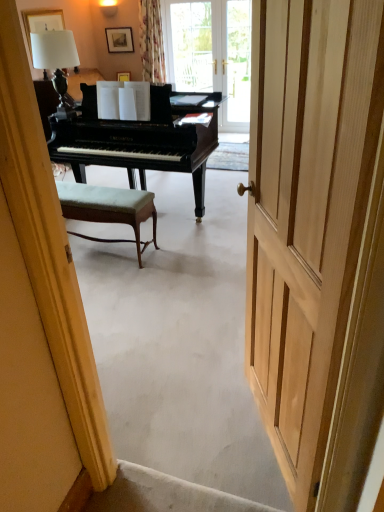
The height and width of the screenshot is (512, 384). Describe the element at coordinates (307, 212) in the screenshot. I see `light wood door at center` at that location.

This screenshot has height=512, width=384. Describe the element at coordinates (238, 63) in the screenshot. I see `clear glass door at center` at that location.

Find the location of a particular element. floral fabric curtain at upper center is located at coordinates (151, 41).

What do you see at coordinates (124, 76) in the screenshot?
I see `matte gold picture frame at upper center, which is the first picture frame from bottom to top` at bounding box center [124, 76].

The width and height of the screenshot is (384, 512). In order to click on green fabric bench at center in this screenshot , I will do `click(108, 209)`.

The height and width of the screenshot is (512, 384). What do you see at coordinates (141, 139) in the screenshot?
I see `high-gloss black piano at center` at bounding box center [141, 139].

What do you see at coordinates (119, 40) in the screenshot? I see `matte black picture frame at upper center, which ranks as the 2th picture frame in bottom-to-top order` at bounding box center [119, 40].

This screenshot has height=512, width=384. Identify the location of light wood door at center. (307, 212).

Can we say clear glass door at center lies outside high-gloss black piano at center?

That's correct, clear glass door at center is outside of high-gloss black piano at center.

Which object is positioned more to the right, clear glass door at center or high-gloss black piano at center?

clear glass door at center is more to the right.

Is clear glass door at center thinner than high-gloss black piano at center?

Indeed, clear glass door at center has a lesser width compared to high-gloss black piano at center.

How distant is clear glass door at center from high-gloss black piano at center?

A distance of 7.12 feet exists between clear glass door at center and high-gloss black piano at center.

Is the position of matte black picture frame at upper center, which ranks as the 2th picture frame in bottom-to-top order, more distant than that of white fabric lampshade at upper left?

Yes, matte black picture frame at upper center, which ranks as the 2th picture frame in bottom-to-top order, is further from the camera.

Is matte black picture frame at upper center, the first picture frame viewed from the top, not near white fabric lampshade at upper left?

Indeed, matte black picture frame at upper center, the first picture frame viewed from the top, is not near white fabric lampshade at upper left.

Which object is thinner, matte black picture frame at upper center, the first picture frame viewed from the top, or white fabric lampshade at upper left?

matte black picture frame at upper center, the first picture frame viewed from the top, is thinner.

Who is taller, matte black picture frame at upper center, the first picture frame viewed from the top, or white fabric lampshade at upper left?

Standing taller between the two is white fabric lampshade at upper left.

Is green fabric bench at center positioned far away from light wood door at center?

Yes, green fabric bench at center is far from light wood door at center.

From a real-world perspective, between green fabric bench at center and light wood door at center, who is vertically lower?

green fabric bench at center.

Identify the location of door below the green fabric bench at center (from the image's perspective). (307, 212).

Which is correct: green fabric bench at center is inside high-gloss black piano at center, or outside of it?

green fabric bench at center is spatially situated outside high-gloss black piano at center.

Is green fabric bench at center wider than high-gloss black piano at center?

No.

This screenshot has height=512, width=384. I want to click on chair below the high-gloss black piano at center (from the image's perspective), so click(108, 209).

Is the position of green fabric bench at center less distant than that of high-gloss black piano at center?

No, green fabric bench at center is further to the viewer.

From a real-world perspective, who is located higher, clear glass door at center or matte black picture frame at upper center, the first picture frame viewed from the top?

matte black picture frame at upper center, the first picture frame viewed from the top.

Is clear glass door at center oriented towards matte black picture frame at upper center, which ranks as the 2th picture frame in bottom-to-top order?

No, clear glass door at center is not turned towards matte black picture frame at upper center, which ranks as the 2th picture frame in bottom-to-top order.

From the image's perspective, is light wood door at center beneath green fabric bench at center?

Yes, from the image's perspective, light wood door at center is below green fabric bench at center.

Does point (352, 276) come in front of point (64, 213)?

Yes, it is.

Is light wood door at center shorter than green fabric bench at center?

No.

Is white fabric lampshade at upper left bigger than matte gold picture frame at upper center, marked as the second picture frame in a top-to-bottom arrangement?

Yes.

Based on the photo, what's the angular difference between white fabric lampshade at upper left and matte gold picture frame at upper center, which is the first picture frame from bottom to top,'s facing directions?

5.63 degrees.

From the image's perspective, is white fabric lampshade at upper left located beneath matte gold picture frame at upper center, which is the first picture frame from bottom to top?

Correct, white fabric lampshade at upper left appears lower than matte gold picture frame at upper center, which is the first picture frame from bottom to top, in the image.

From a real-world perspective, which is physically below, white fabric lampshade at upper left or matte gold picture frame at upper center, marked as the second picture frame in a top-to-bottom arrangement?

matte gold picture frame at upper center, marked as the second picture frame in a top-to-bottom arrangement, from a real-world perspective.

You are a GUI agent. You are given a task and a screenshot of the screen. Output one action in this format:
    pyautogui.click(x=<x>, y=<y>)
    Task: Click on the window screen behind the high-gloss black piano at center
    Image resolution: width=384 pixels, height=512 pixels.
    Given the screenshot: What is the action you would take?
    point(238,63)

Find the location of a particular element. the 2nd picture frame above when counting from the white fabric lampshade at upper left (from the image's perspective) is located at coordinates (119, 40).

Which object lies further to the anchor point white fabric lampshade at upper left, floral fabric curtain at upper center or matte black picture frame at upper center, which ranks as the 2th picture frame in bottom-to-top order?

The object further to white fabric lampshade at upper left is matte black picture frame at upper center, which ranks as the 2th picture frame in bottom-to-top order.

Looking at the image, which one is located further to high-gloss black piano at center, matte gold picture frame at upper center, marked as the second picture frame in a top-to-bottom arrangement, or light wood door at center?

The object further to high-gloss black piano at center is matte gold picture frame at upper center, marked as the second picture frame in a top-to-bottom arrangement.

Considering their positions, is matte gold picture frame at upper center, which is the first picture frame from bottom to top, positioned further to light wood door at center than green fabric bench at center?

matte gold picture frame at upper center, which is the first picture frame from bottom to top.

Based on their spatial positions, is clear glass door at center or matte gold picture frame at upper center, marked as the second picture frame in a top-to-bottom arrangement, closer to high-gloss black piano at center?

clear glass door at center is closer to high-gloss black piano at center.

Considering their positions, is matte gold picture frame at upper center, which is the first picture frame from bottom to top, positioned further to high-gloss black piano at center than floral fabric curtain at upper center?

matte gold picture frame at upper center, which is the first picture frame from bottom to top, lies further to high-gloss black piano at center than the other object.

Based on their spatial positions, is clear glass door at center or high-gloss black piano at center closer to matte black picture frame at upper center, which ranks as the 2th picture frame in bottom-to-top order?

clear glass door at center.

Considering their positions, is light wood door at center positioned closer to floral fabric curtain at upper center than green fabric bench at center?

Based on the image, green fabric bench at center appears to be nearer to floral fabric curtain at upper center.

Considering their positions, is light wood door at center positioned further to matte gold picture frame at upper center, marked as the second picture frame in a top-to-bottom arrangement, than floral fabric curtain at upper center?

light wood door at center is positioned further to the anchor matte gold picture frame at upper center, marked as the second picture frame in a top-to-bottom arrangement.

In order to click on picture frame between light wood door at center and matte gold picture frame at upper center, marked as the second picture frame in a top-to-bottom arrangement, along the z-axis in this screenshot , I will do `click(119, 40)`.

Image resolution: width=384 pixels, height=512 pixels. I want to click on picture frame between matte black picture frame at upper center, the first picture frame viewed from the top, and clear glass door at center from left to right, so click(124, 76).

Find the location of a particular element. window screen between light wood door at center and matte gold picture frame at upper center, marked as the second picture frame in a top-to-bottom arrangement, from front to back is located at coordinates pos(238,63).

Image resolution: width=384 pixels, height=512 pixels. What are the coordinates of `chair between high-gloss black piano at center and matte black picture frame at upper center, the first picture frame viewed from the top, from front to back` in the screenshot? It's located at (108, 209).